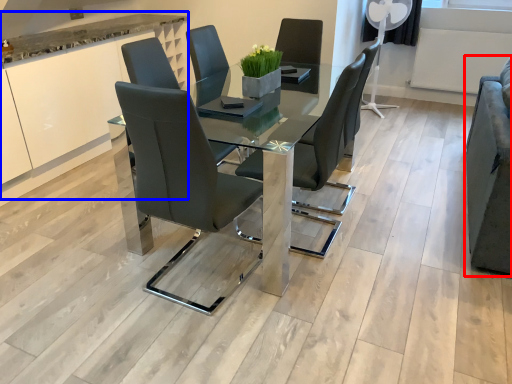
Question: Which object is closer to the camera taking this photo, armchair (highlighted by a red box) or cabinetry (highlighted by a blue box)?

Choices:
 (A) armchair
 (B) cabinetry

Answer: (A)